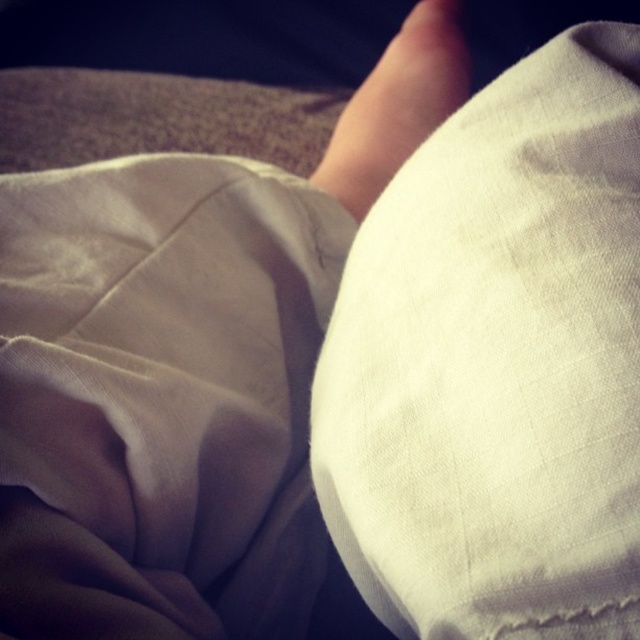
Can you confirm if white cotton pillow at center is positioned above skinny beige foot at center?

Incorrect, white cotton pillow at center is not positioned above skinny beige foot at center.

Is white cotton pillow at center to the left of skinny beige foot at center from the viewer's perspective?

In fact, white cotton pillow at center is to the right of skinny beige foot at center.

The width and height of the screenshot is (640, 640). I want to click on white cotton pillow at center, so click(497, 364).

Measure the distance between white cotton blanket at lower left and camera.

white cotton blanket at lower left and camera are 9.57 inches apart from each other.

Who is more distant from viewer, [120,579] or [416,40]?

Point [416,40]

The width and height of the screenshot is (640, 640). Describe the element at coordinates (161, 397) in the screenshot. I see `white cotton blanket at lower left` at that location.

Where is `white cotton blanket at lower left`? white cotton blanket at lower left is located at coordinates (161, 397).

Who is lower down, white cotton pillow at center or white cotton blanket at lower left?

white cotton blanket at lower left is below.

Measure the distance from white cotton pillow at center to white cotton blanket at lower left.

They are 4.10 inches apart.

Who is more distant from viewer, (401, 301) or (276, 260)?

The point (276, 260) is more distant.

Find the location of a particular element. white cotton pillow at center is located at coordinates (497, 364).